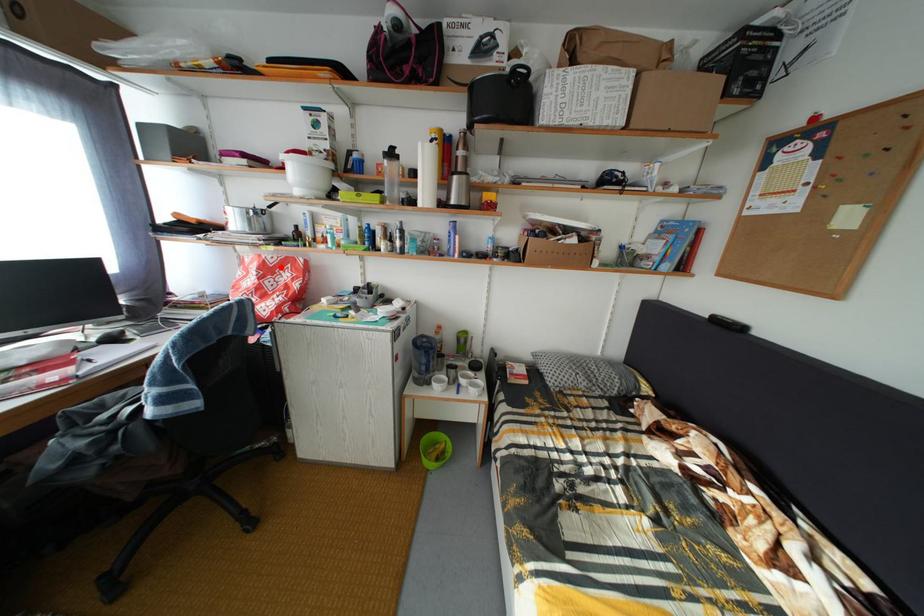
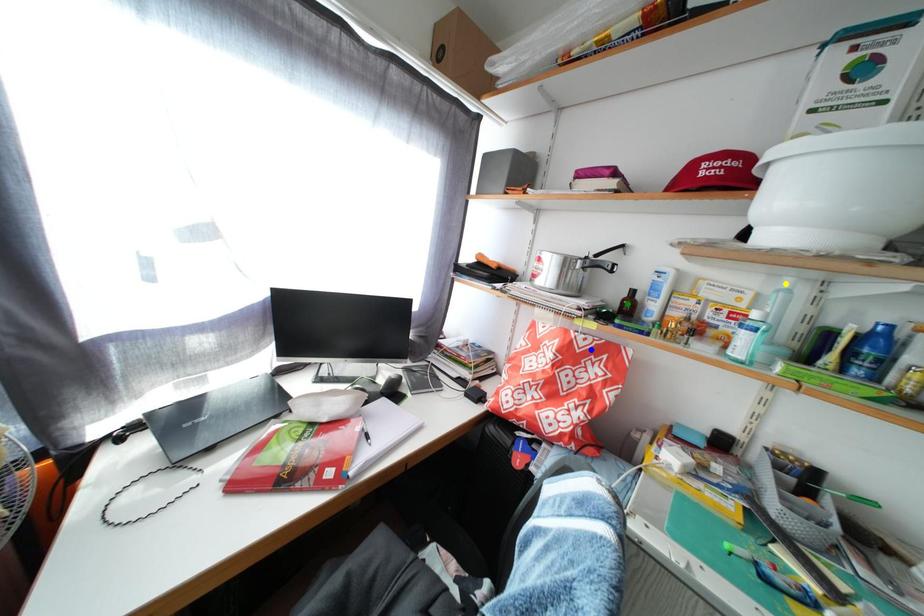
Question: I am providing you with two images of the same scene from different viewpoints. A red point is marked on the first image. You are given multiple points on the second image. Which point in image 2 is actually the same real-world point as the red point in image 1?

Choices:
 (A) green point
 (B) blue point
 (C) yellow point

Answer: (B)